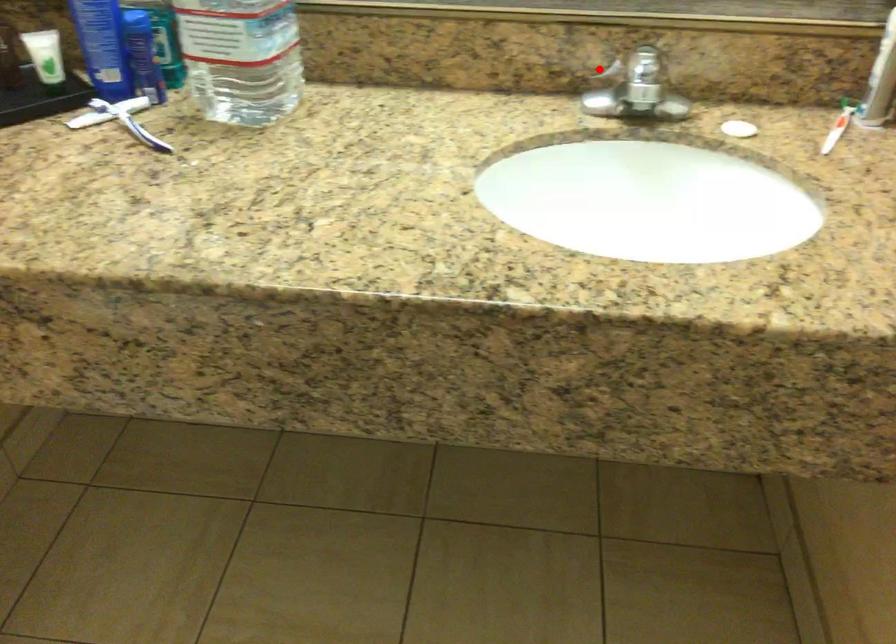
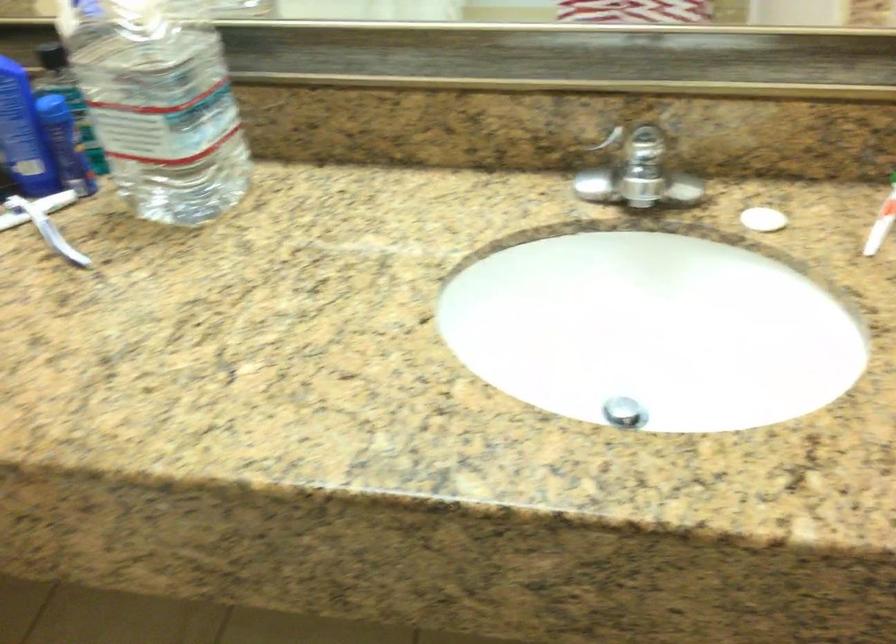
Where in the second image is the point corresponding to the highlighted location from the first image?

(599, 144)